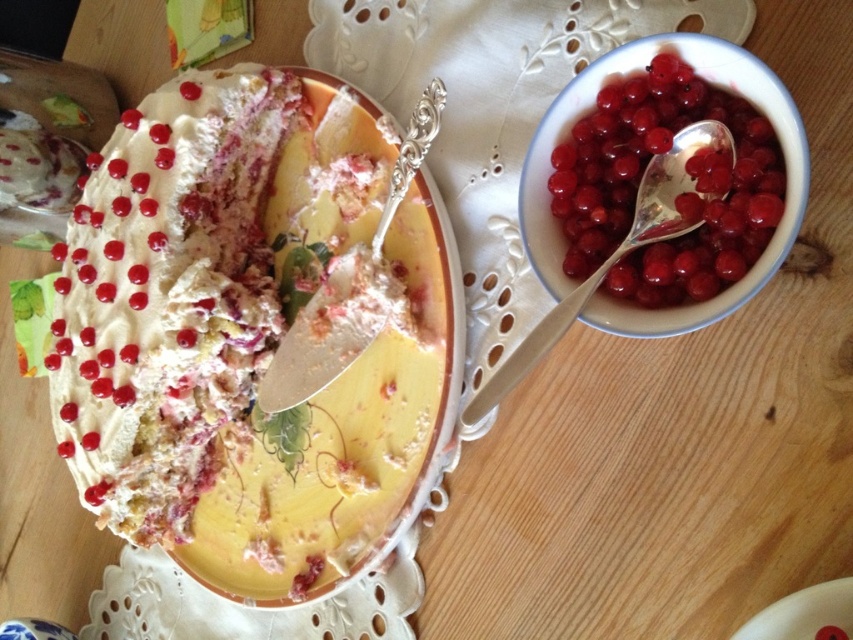
Question: Does white creamy cake at center have a lesser width compared to matte white cake at upper left?

Choices:
 (A) yes
 (B) no

Answer: (B)

Question: Does porcelain bowl filled with red berries at upper right appear on the right side of matte white cake at upper left?

Choices:
 (A) no
 (B) yes

Answer: (B)

Question: Which point appears farthest from the camera in this image?

Choices:
 (A) (772, 84)
 (B) (59, 161)
 (C) (352, 564)
 (D) (666, 198)

Answer: (B)

Question: Which object is closer to the camera taking this photo?

Choices:
 (A) porcelain bowl filled with red berries at upper right
 (B) silver metallic spoon at upper right
 (C) matte white cake at upper left

Answer: (A)

Question: Which point is closer to the camera taking this photo?

Choices:
 (A) (631, 316)
 (B) (35, 90)
 (C) (262, 532)
 (D) (657, 234)

Answer: (A)

Question: Is matte white cake at upper left wider than silver metallic spoon at upper right?

Choices:
 (A) no
 (B) yes

Answer: (A)